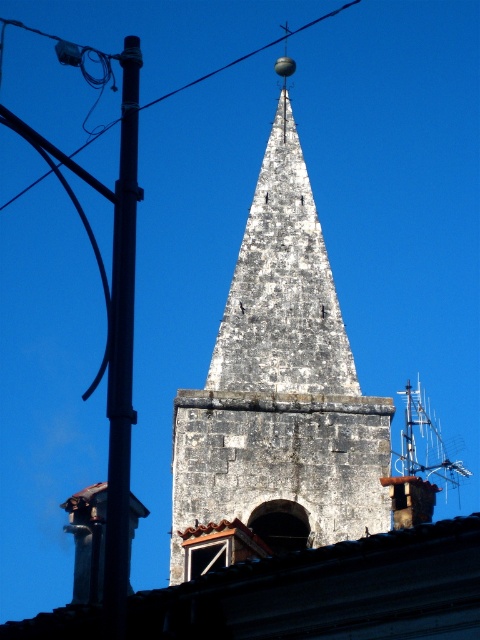
This screenshot has width=480, height=640. What are the coordinates of `metallic pole at left` in the screenshot? It's located at (121, 349).

Is metallic pole at left closer to camera compared to black wire at upper left?

Yes, it is in front of black wire at upper left.

Find the location of a particular element. This screenshot has height=640, width=480. metallic pole at left is located at coordinates (121, 349).

Can you confirm if weathered stone steeple at center is bigger than metallic pole at left?

No, weathered stone steeple at center is not bigger than metallic pole at left.

I want to click on weathered stone steeple at center, so click(277, 394).

How far apart are weathered stone steeple at center and black wire at upper left?

The distance of weathered stone steeple at center from black wire at upper left is 86.51 meters.

Can you confirm if weathered stone steeple at center is positioned above black wire at upper left?

Actually, weathered stone steeple at center is below black wire at upper left.

Who is more distant from viewer, (184, 445) or (88, 141)?

Point (88, 141)

Locate an element on the screen. The height and width of the screenshot is (640, 480). weathered stone steeple at center is located at coordinates (277, 394).